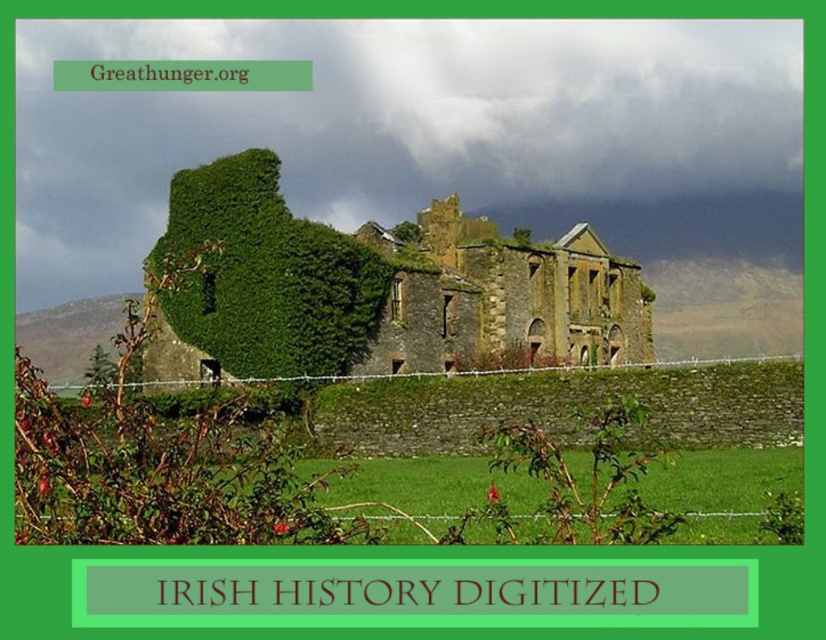
You are a photographer planning to capture the green mossy stone building at center and the stone wall at center in a single frame. Based on their sizes, which object should you position closer to the edge of the frame to ensure both are fully visible?

The green mossy stone building at center is wider than the stone wall at center. To ensure both are fully visible in the frame, position the stone wall at center closer to the edge of the frame since it is narrower.

You are standing at the point marked by the coordinates point (376, 289) in the image. Based on the scene description, what structure are you directly observing from that location?

The point (376, 289) corresponds to the green mossy stone building at center, so you are directly observing the green mossy stone building at center from that location.

You are a construction inspector assessing the stability of the green mossy stone building at center and the stone wall at center. Which structure is taller?

The green mossy stone building at center is taller than the stone wall at center.